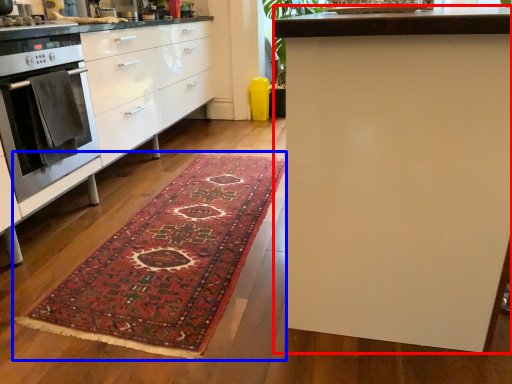
Question: Which object is further to the camera taking this photo, table (highlighted by a red box) or mat (highlighted by a blue box)?

Choices:
 (A) table
 (B) mat

Answer: (B)